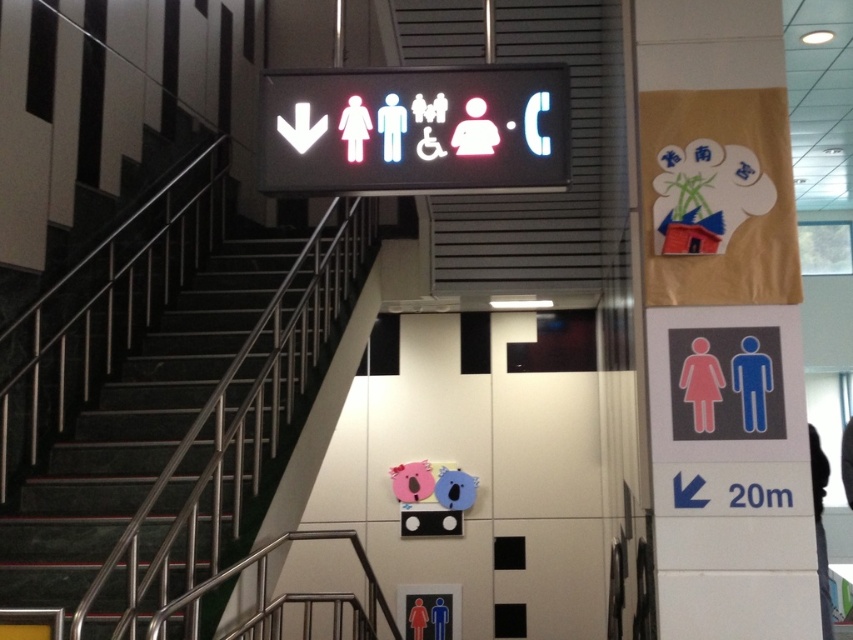
You are standing in the public building and need to go down the stairs. The digital signboard above the staircase indicates the direction of the restrooms. If you face the black marble stairs at left, which direction should you turn to find the restrooms according to the signboard?

The restrooms are located in the direction indicated by the downward arrow on the digital signboard above the staircase. Since the black marble stairs at left are to your left, you should turn towards the downward arrow direction, which is likely straight ahead or to the right, depending on the signboard layout. However, without specific arrow direction details, the safest path is to follow the downward arrow indicated on the signboard above the black marble stairs at left.

You are standing in the public building and want to reach the point at coordinates point (1,545). If you can move forward 4 meters, will you be able to reach it?

The distance of point (1,545) from viewer is 4.48 meters, so moving forward 4 meters will not be enough to reach it. You need to move an additional 0.48 meters.

You are a maintenance worker needing to reach the white plastic sign at center for repairs. The black marble stairs at left are available. Considering their height, is the stairs sufficient to reach the sign?

The black marble stairs at left is much taller than the white plastic sign at center, so yes, the stairs are sufficient to reach the sign.